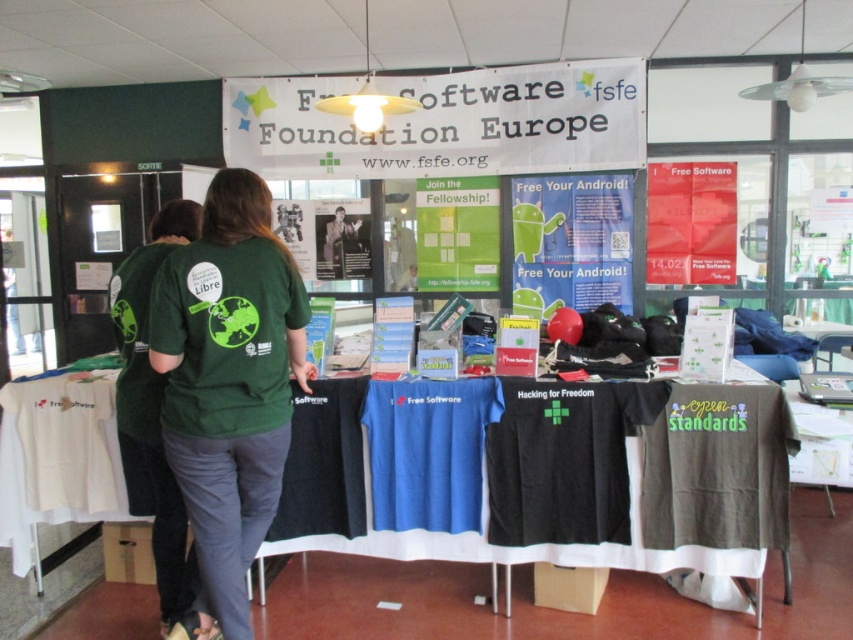
You are at the FSFE booth and want to hang both the matte red poster at center and the green paper poster at center on the wall. If the wall space available is exactly the width of the wider of the two posters, which poster should you choose to maximize the use of space?

The matte red poster at center should be chosen because it is wider than the green paper poster at center, allowing better utilization of the available wall space.